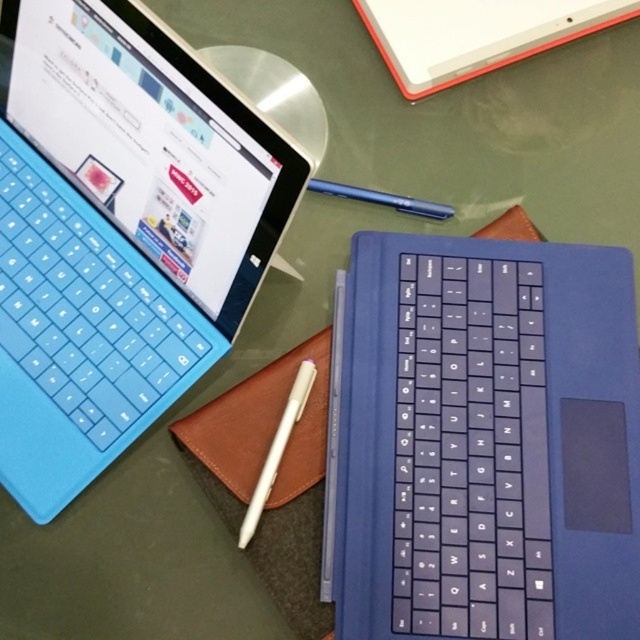
Based on the photo, you are setting up a presentation and need to know the arrangement of the equipment. Which object is positioned lower on the table between the blue rubberized keyboard at upper left and the white matte laptop at upper center?

The blue rubberized keyboard at upper left is positioned lower on the table than the white matte laptop at upper center.

What is the exact coordinate of the blue rubberized keyboard at upper left?

The blue rubberized keyboard at upper left is located at coordinate point (x=120, y=236).

You are setting up a presentation and need to place a 12cm tall USB drive between the blue rubberized keyboard at upper left and the white matte laptop at upper center. Can the USB drive fit vertically between them?

The blue rubberized keyboard at upper left is bigger than the white matte laptop at upper center. However, the description does not provide specific measurements of the vertical space between them. Without knowing the exact height difference or the available vertical space, it is impossible to determine if the USB drive can fit vertically between them.